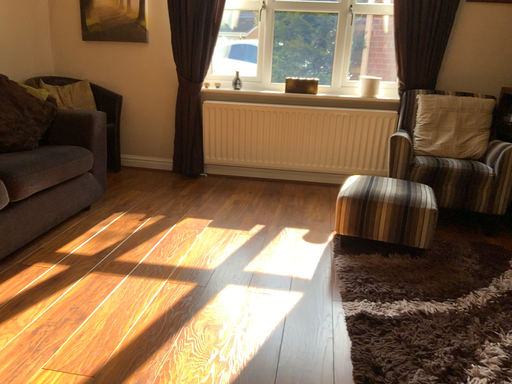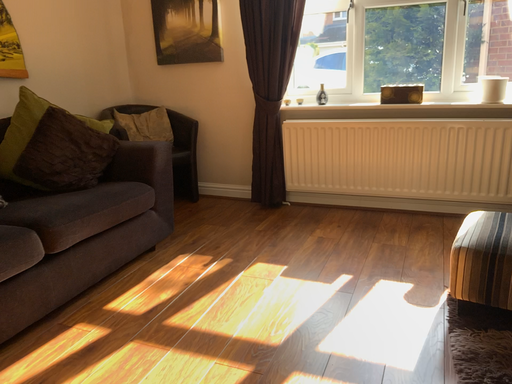
Question: Which way did the camera rotate in the video?

Choices:
 (A) rotated right
 (B) rotated left

Answer: (B)